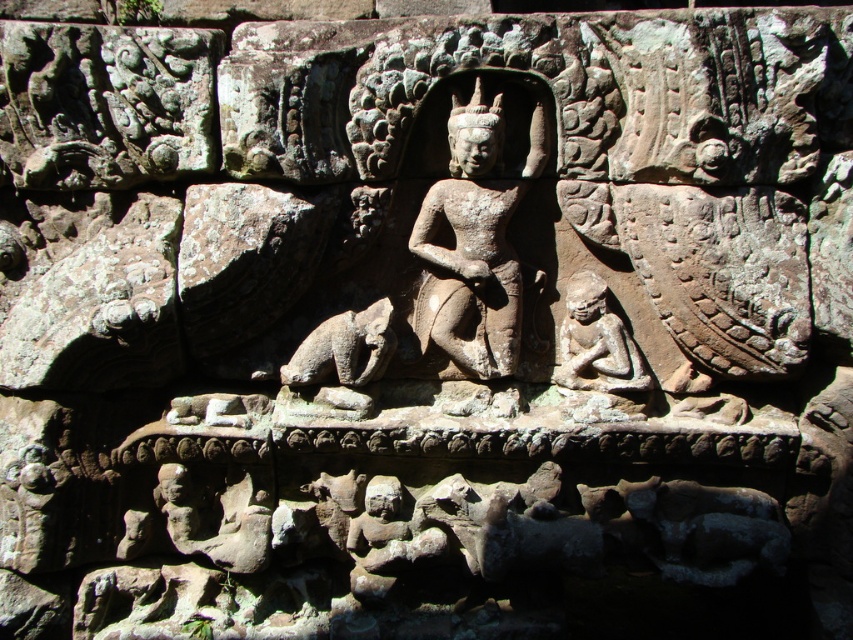
Question: Which object is the farthest from the carved stone figure at center?

Choices:
 (A) brown stone dog at center
 (B) gray stone statue at center

Answer: (A)

Question: Which object appears closest to the camera in this image?

Choices:
 (A) carved stone figure at center
 (B) gray stone statue at center

Answer: (B)

Question: Does gray stone statue at center appear on the right side of carved stone figure at center?

Choices:
 (A) yes
 (B) no

Answer: (B)

Question: Is carved stone figure at center below brown stone dog at center?

Choices:
 (A) no
 (B) yes

Answer: (A)

Question: Which of the following is the farthest from the observer?

Choices:
 (A) gray stone statue at center
 (B) brown stone dog at center
 (C) carved stone figure at center

Answer: (C)

Question: Does carved stone figure at center appear on the left side of brown stone dog at center?

Choices:
 (A) yes
 (B) no

Answer: (B)